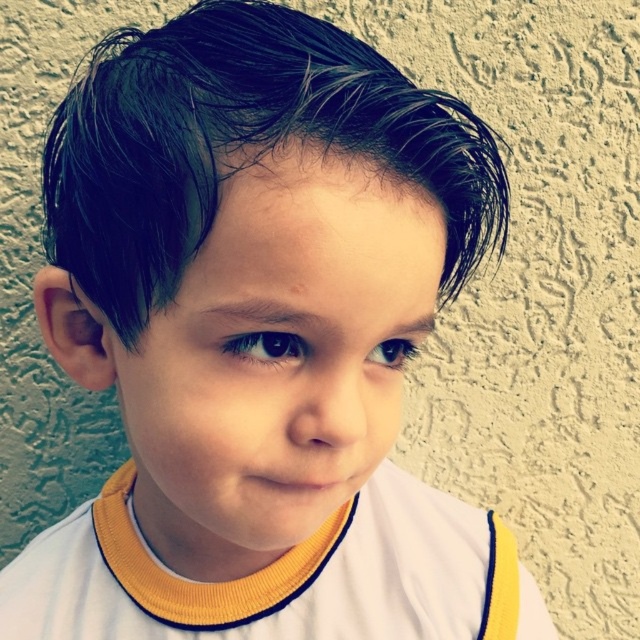
You are a photographer adjusting the lighting in a studio. You notice the wet black hair at center and the white jersey at center. Which object is closer to the camera lens?

The wet black hair at center is closer to the camera lens because it is in front of the white jersey at center.

You are a photographer adjusting lighting for a portrait. You notice the wet black hair at center and the white jersey at center. Which object would cast a stronger shadow due to its thickness?

The white jersey at center is thicker than the wet black hair at center, so it would cast a stronger shadow.